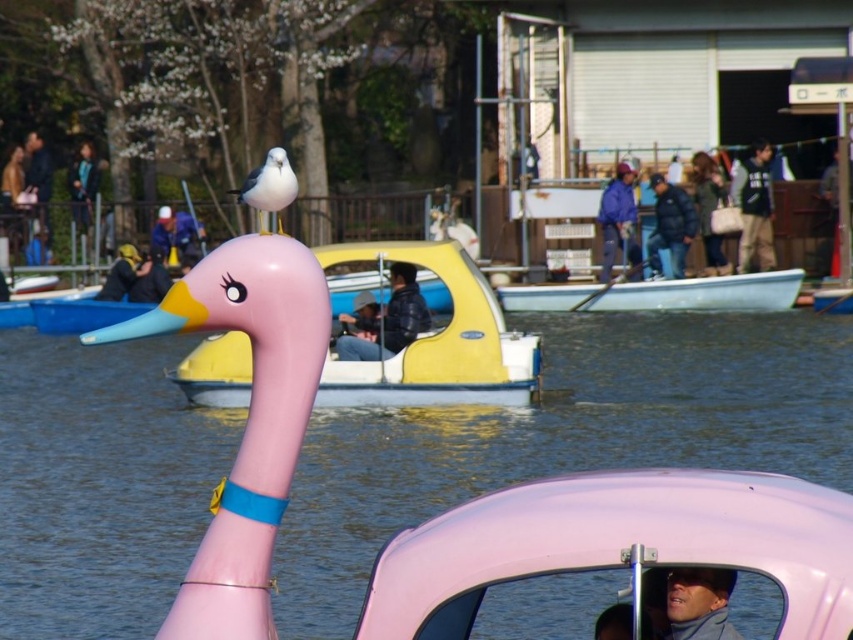
Question: Which object is the closest to the white glossy seagull at upper center?

Choices:
 (A) leather jacket at center
 (B) pink rubber duck at center
 (C) denim jacket at upper center

Answer: (B)

Question: Is pink rubber duck boat at center wider than blue fabric jacket at center?

Choices:
 (A) no
 (B) yes

Answer: (B)

Question: Is black puffer jacket at center wider than white glossy seagull at upper center?

Choices:
 (A) yes
 (B) no

Answer: (B)

Question: Which of these objects is positioned closest to the denim jacket at upper center?

Choices:
 (A) blue fabric jacket at center
 (B) white glossy seagull at upper center

Answer: (A)

Question: Which object is positioned closest to the pink rubber duck at center?

Choices:
 (A) pink matte plastic boat at center
 (B) black cotton shirt at upper right
 (C) black puffer jacket at center

Answer: (C)

Question: Does matte pink rubber duck at center have a lesser width compared to white glossy seagull at upper center?

Choices:
 (A) no
 (B) yes

Answer: (B)